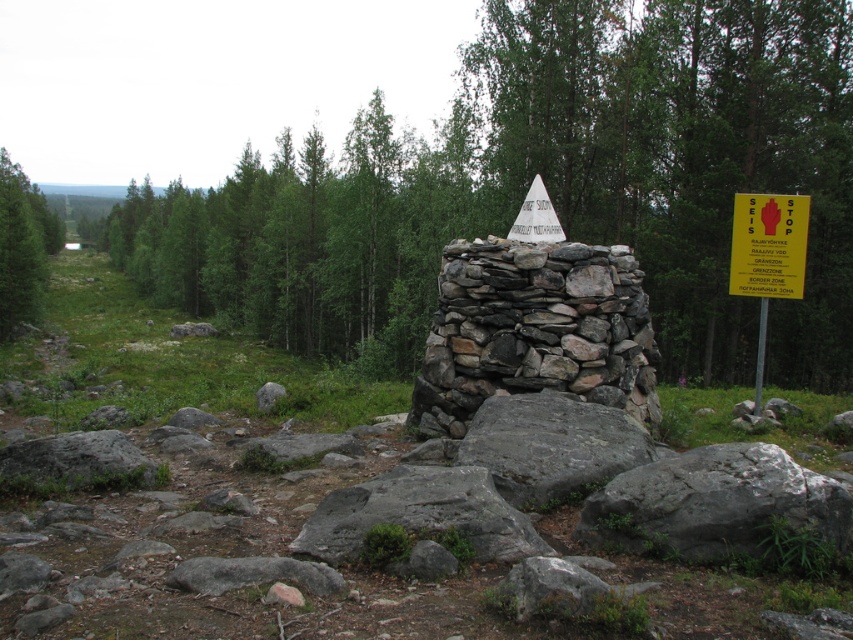
You are a hiker who has just arrived at the stone cairn in the forest. You notice a yellow paper sign at right and a yellow paper triangle at center. If you want to read both, which one should you approach first to ensure you can read both without moving too far?

You should approach the yellow paper triangle at center first because it is closer to the stone cairn where you are standing, and then you can easily reach the yellow paper sign at right since they are 9.51 feet apart.